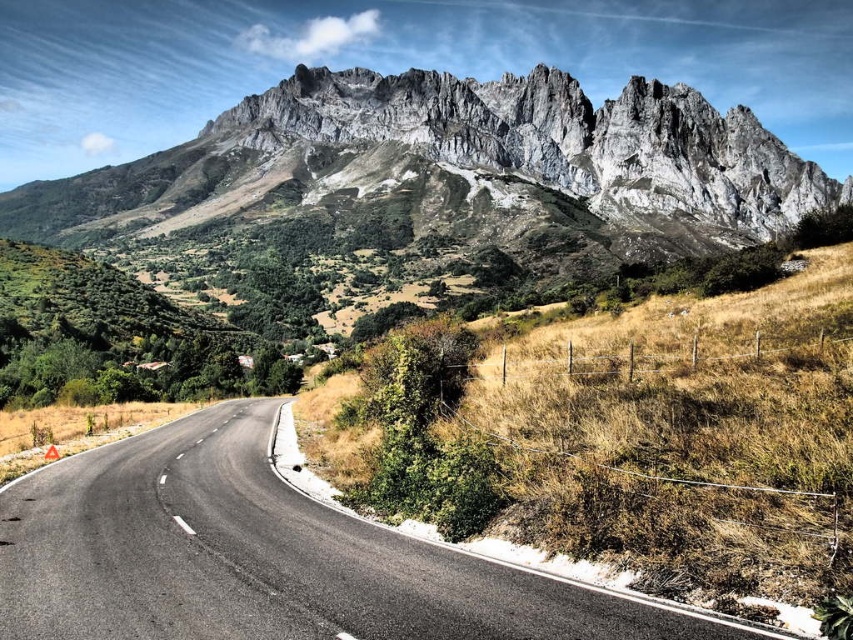
You are a hiker planning to take a photo of the rugged stone mountain range at upper center and the black asphalt road at center. Which object will appear larger in the photo?

The rugged stone mountain range at upper center will appear larger in the photo because it is much taller than the black asphalt road at center.

Based on the scene description, what is located at the coordinates point (457, 170)?

The rugged stone mountain range at upper center is located at point (457, 170).